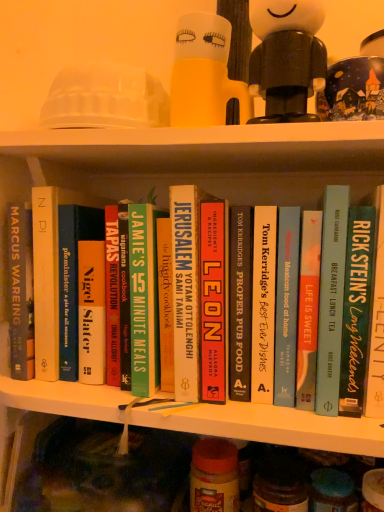
Locate an element on the screen. The width and height of the screenshot is (384, 512). vacant area in front of black hardcover book at center, marked as the 4th book in a right-to-left arrangement is located at coordinates (271, 413).